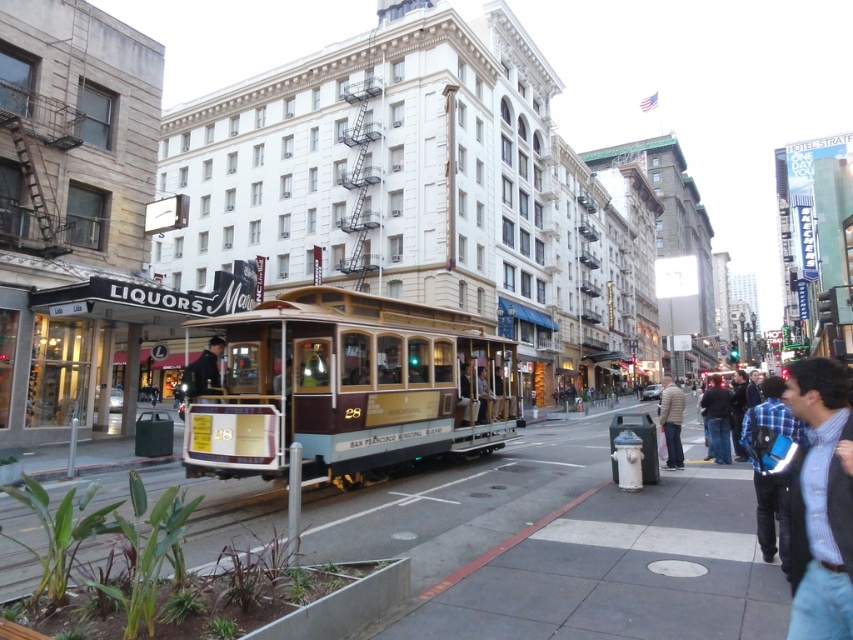
Can you confirm if gold polished cable car at center is wider than dark blue jacket at center?

Yes.

Who is shorter, gold polished cable car at center or dark blue jacket at center?

With less height is dark blue jacket at center.

Is point (323, 451) farther from camera compared to point (190, 381)?

No, (323, 451) is in front of (190, 381).

Where is `gold polished cable car at center`? Image resolution: width=853 pixels, height=640 pixels. gold polished cable car at center is located at coordinates (349, 387).

Does light brown leather jacket at center have a smaller size compared to dark blue jacket at center?

No.

Which of these two, light brown leather jacket at center or dark blue jacket at center, stands shorter?

dark blue jacket at center

This screenshot has height=640, width=853. Describe the element at coordinates (671, 420) in the screenshot. I see `light brown leather jacket at center` at that location.

Where is `light brown leather jacket at center`? light brown leather jacket at center is located at coordinates (671, 420).

Who is lower down, dark blue jeans at lower right or dark blue jacket at center?

dark blue jeans at lower right is lower down.

The height and width of the screenshot is (640, 853). I want to click on dark blue jeans at lower right, so click(x=717, y=419).

This screenshot has width=853, height=640. Find the location of `dark blue jeans at lower right`. dark blue jeans at lower right is located at coordinates (717, 419).